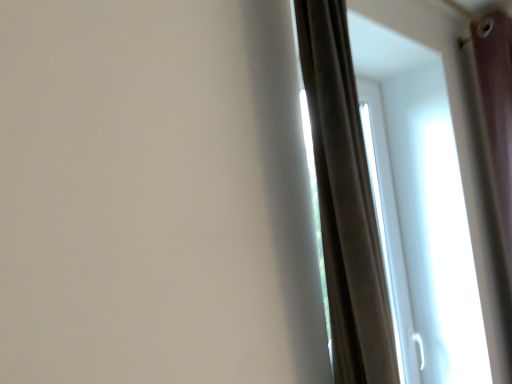
Question: Should I look upward or downward to see brown velvet curtain at right?

Choices:
 (A) down
 (B) up

Answer: (A)